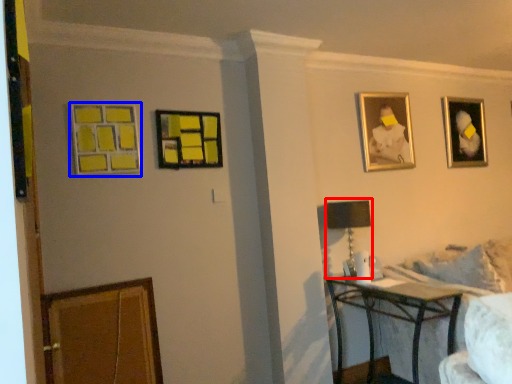
Question: Which object appears closest to the camera in this image, table lamp (highlighted by a red box) or picture frame (highlighted by a blue box)?

Choices:
 (A) table lamp
 (B) picture frame

Answer: (B)